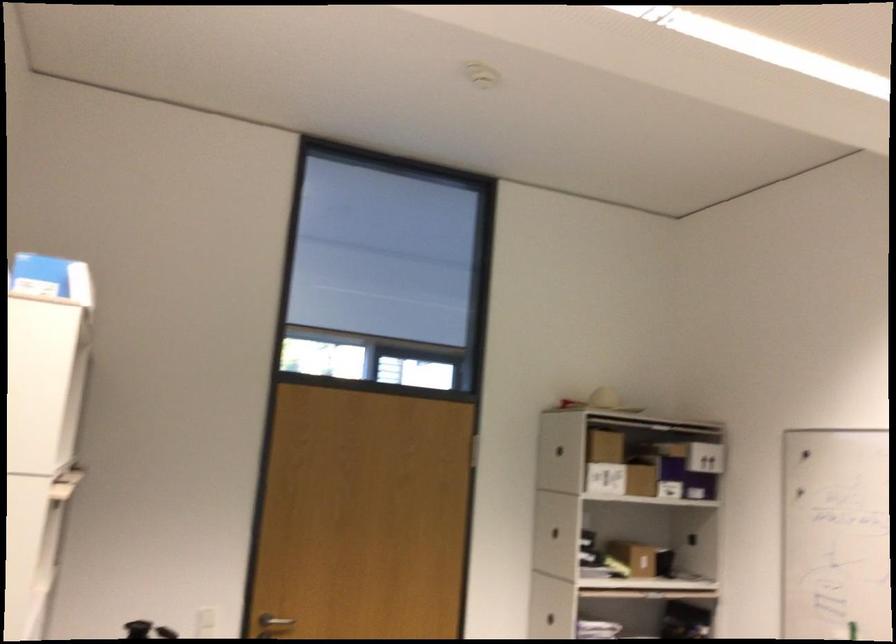
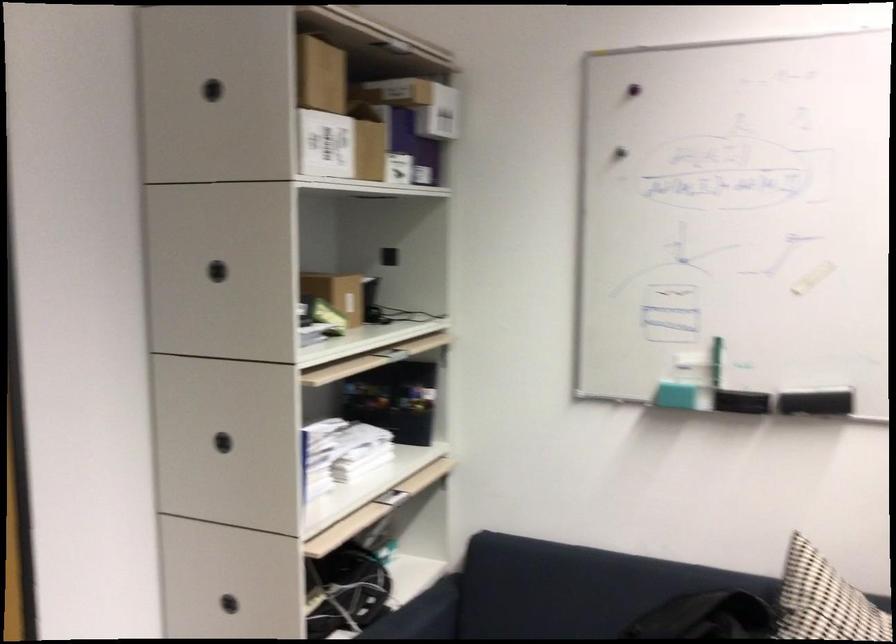
Find the pixel in the second image that matches the point at 558,444 in the first image.

(211, 90)